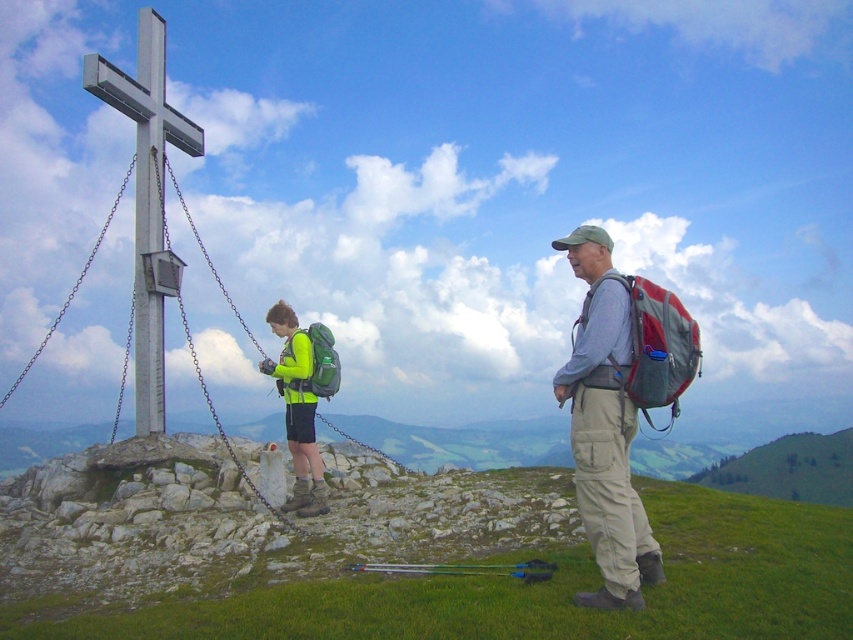
Can you confirm if matte gray backpack at right is wider than metallic silver cross at upper left?

No.

Is matte gray backpack at right smaller than metallic silver cross at upper left?

Correct, matte gray backpack at right occupies less space than metallic silver cross at upper left.

Does point (625, 340) come in front of point (142, 355)?

Yes, point (625, 340) is in front of point (142, 355).

Identify the location of matte gray backpack at right. The width and height of the screenshot is (853, 640). (605, 428).

Between matte gray backpack at right and green matte backpack at center, which one has less height?

Standing shorter between the two is green matte backpack at center.

Is the position of matte gray backpack at right less distant than that of green matte backpack at center?

That is True.

The height and width of the screenshot is (640, 853). What do you see at coordinates (605, 428) in the screenshot? I see `matte gray backpack at right` at bounding box center [605, 428].

Locate an element on the screen. Image resolution: width=853 pixels, height=640 pixels. matte gray backpack at right is located at coordinates (605, 428).

Describe the element at coordinates (148, 200) in the screenshot. I see `metallic silver cross at upper left` at that location.

Is metallic silver cross at upper left thinner than green matte backpack at center?

No.

The height and width of the screenshot is (640, 853). Describe the element at coordinates (148, 200) in the screenshot. I see `metallic silver cross at upper left` at that location.

I want to click on metallic silver cross at upper left, so click(x=148, y=200).